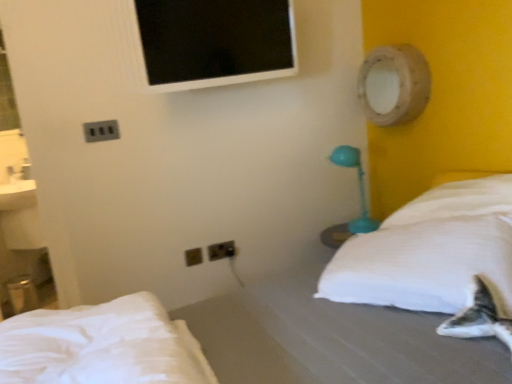
Question: Is white soft bed at lower left, placed as the 2th bed when sorted from bottom to top, further to camera compared to teal plastic table lamp at right?

Choices:
 (A) yes
 (B) no

Answer: (B)

Question: Considering the relative positions of white soft bed at lower left, placed as the 2th bed when sorted from bottom to top, and teal plastic table lamp at right in the image provided, is white soft bed at lower left, placed as the 2th bed when sorted from bottom to top, to the right of teal plastic table lamp at right from the viewer's perspective?

Choices:
 (A) no
 (B) yes

Answer: (A)

Question: Is white soft bed at lower left, placed as the 2th bed when sorted from bottom to top, shorter than teal plastic table lamp at right?

Choices:
 (A) no
 (B) yes

Answer: (B)

Question: Is white soft bed at lower left, placed as the 2th bed when sorted from bottom to top, not close to teal plastic table lamp at right?

Choices:
 (A) yes
 (B) no

Answer: (A)

Question: Does white soft bed at lower left, placed as the 2th bed when sorted from bottom to top, contain teal plastic table lamp at right?

Choices:
 (A) no
 (B) yes

Answer: (A)

Question: Would you say white soft bed at lower left, placed as the 2th bed when sorted from bottom to top, is outside teal plastic table lamp at right?

Choices:
 (A) yes
 (B) no

Answer: (A)

Question: Does black plastic outlet at lower center, the 2th electric outlet when ordered from top to bottom, have a lesser height compared to white soft bed at lower left, placed as the 2th bed when sorted from bottom to top?

Choices:
 (A) yes
 (B) no

Answer: (A)

Question: From the image's perspective, is black plastic outlet at lower center, positioned as the 1th electric outlet in back-to-front order, below white soft bed at lower left, which ranks as the 1th bed in top-to-bottom order?

Choices:
 (A) no
 (B) yes

Answer: (A)

Question: Is black plastic outlet at lower center, the 3th electric outlet positioned from the front, at the right side of white soft bed at lower left, which ranks as the 1th bed in top-to-bottom order?

Choices:
 (A) no
 (B) yes

Answer: (B)

Question: From a real-world perspective, is black plastic outlet at lower center, which is the second electric outlet in bottom-to-top order, under white soft bed at lower left, placed as the 2th bed when sorted from bottom to top?

Choices:
 (A) no
 (B) yes

Answer: (B)

Question: Is black plastic outlet at lower center, marked as the third electric outlet in a left-to-right arrangement, at the left side of white soft bed at lower left, placed as the 2th bed when sorted from bottom to top?

Choices:
 (A) yes
 (B) no

Answer: (B)

Question: Is black plastic outlet at lower center, marked as the third electric outlet in a left-to-right arrangement, touching white soft bed at lower left, placed as the 2th bed when sorted from bottom to top?

Choices:
 (A) no
 (B) yes

Answer: (A)

Question: From a real-world perspective, is white fabric bed at center, arranged as the 1th bed when ordered from the bottom, over black plastic electric outlet at lower center, which is the second electric outlet in front-to-back order?

Choices:
 (A) no
 (B) yes

Answer: (A)